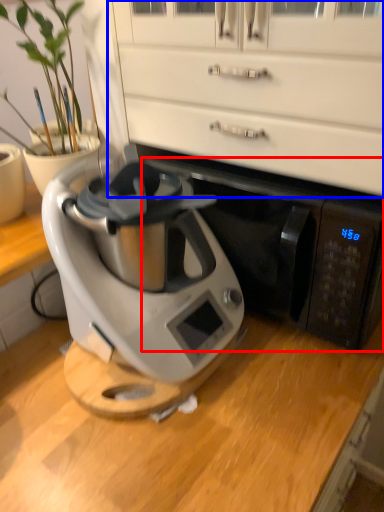
Question: Which point is further to the camera, wide (highlighted by a red box) or dresser (highlighted by a blue box)?

Choices:
 (A) wide
 (B) dresser

Answer: (A)